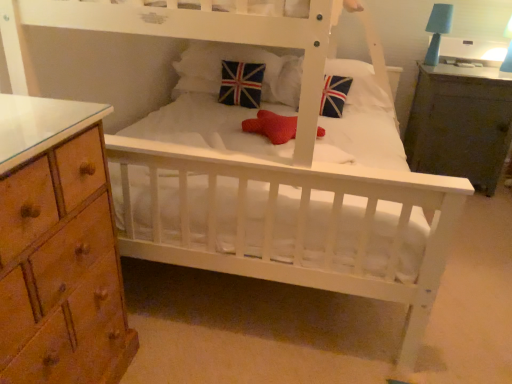
Question: Does dark wood nightstand at right have a lesser height compared to blue matte table lamp at upper right?

Choices:
 (A) no
 (B) yes

Answer: (A)

Question: From the image's perspective, is dark wood nightstand at right under blue matte table lamp at upper right?

Choices:
 (A) no
 (B) yes

Answer: (B)

Question: Can you confirm if dark wood nightstand at right is positioned to the left of blue matte table lamp at upper right?

Choices:
 (A) yes
 (B) no

Answer: (B)

Question: From a real-world perspective, is dark wood nightstand at right positioned over blue matte table lamp at upper right based on gravity?

Choices:
 (A) yes
 (B) no

Answer: (B)

Question: Is there a large distance between dark wood nightstand at right and blue matte table lamp at upper right?

Choices:
 (A) yes
 (B) no

Answer: (B)

Question: Is dark wood nightstand at right to the right of blue matte table lamp at upper right from the viewer's perspective?

Choices:
 (A) no
 (B) yes

Answer: (B)

Question: Are velvet union jack pillow at center, the 2th pillow positioned from the left, and union jack fabric pillow at center, the 2th pillow viewed from the right, located far from each other?

Choices:
 (A) no
 (B) yes

Answer: (A)

Question: Does velvet union jack pillow at center, which is the 1th pillow from right to left, have a greater width compared to union jack fabric pillow at center, which is the first pillow from left to right?

Choices:
 (A) no
 (B) yes

Answer: (A)

Question: From a real-world perspective, does velvet union jack pillow at center, the 2th pillow positioned from the left, stand above union jack fabric pillow at center, which is the first pillow from left to right?

Choices:
 (A) no
 (B) yes

Answer: (A)

Question: From a real-world perspective, is velvet union jack pillow at center, which is the 1th pillow from right to left, under union jack fabric pillow at center, the 2th pillow viewed from the right?

Choices:
 (A) yes
 (B) no

Answer: (A)

Question: Is velvet union jack pillow at center, the 2th pillow positioned from the left, bigger than union jack fabric pillow at center, which is the first pillow from left to right?

Choices:
 (A) no
 (B) yes

Answer: (A)

Question: Considering the relative sizes of velvet union jack pillow at center, the 2th pillow positioned from the left, and union jack fabric pillow at center, which is the first pillow from left to right, in the image provided, is velvet union jack pillow at center, the 2th pillow positioned from the left, shorter than union jack fabric pillow at center, which is the first pillow from left to right,?

Choices:
 (A) no
 (B) yes

Answer: (B)

Question: Is union jack fabric pillow at center, the 2th pillow viewed from the right, next to union jack fabric pillow at center and touching it?

Choices:
 (A) no
 (B) yes

Answer: (A)